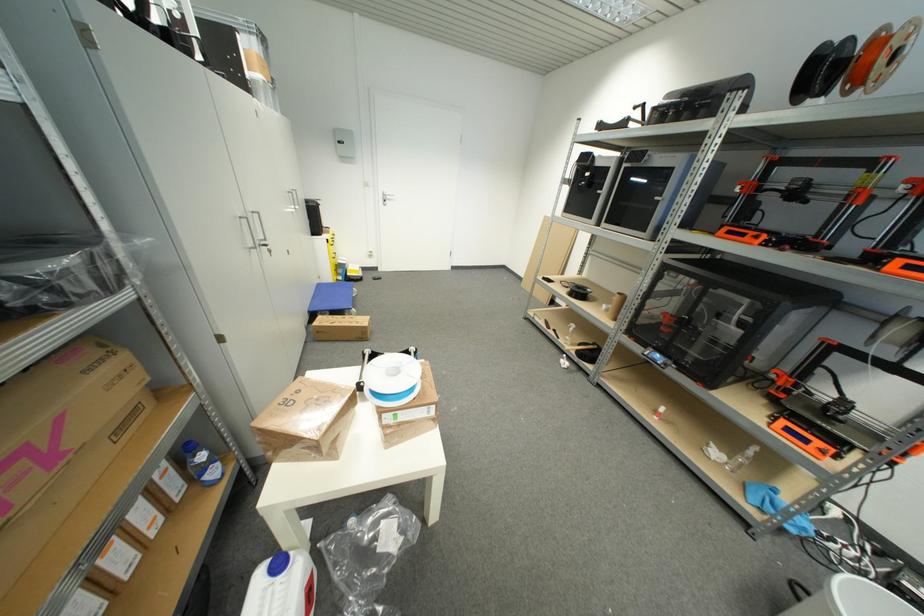
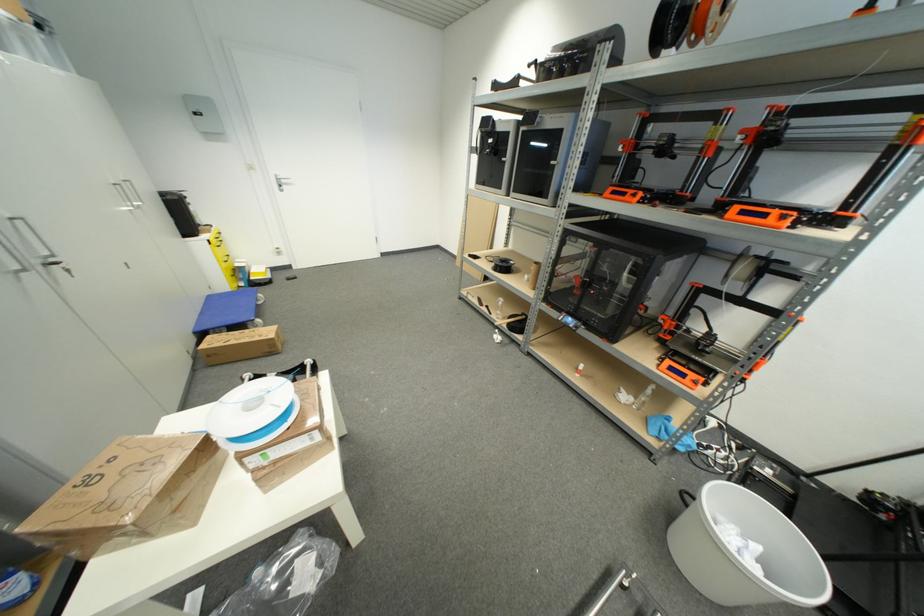
Question: Which direction would the cameraman need to move to produce the second image? Reply with the corresponding letter.

Choices:
 (A) Left
 (B) Right
 (C) Forward
 (D) Backward

Answer: (B)